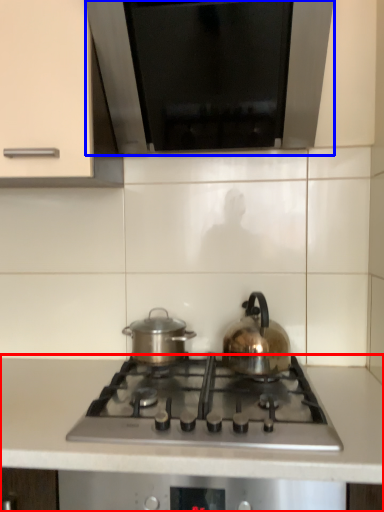
Question: Which object is closer to the camera taking this photo, countertop (highlighted by a red box) or exhaust hood (highlighted by a blue box)?

Choices:
 (A) countertop
 (B) exhaust hood

Answer: (A)